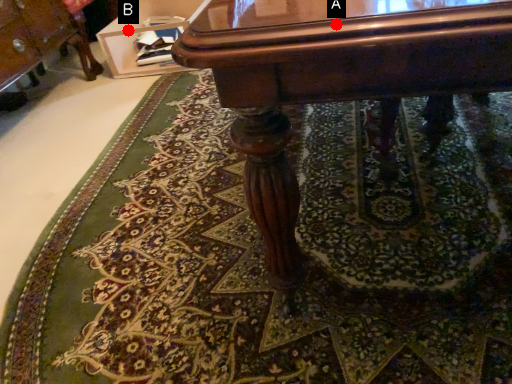
Question: Two points are circled on the image, labeled by A and B beside each circle. Which of the following is the closest to the observer?

Choices:
 (A) A is closer
 (B) B is closer

Answer: (A)